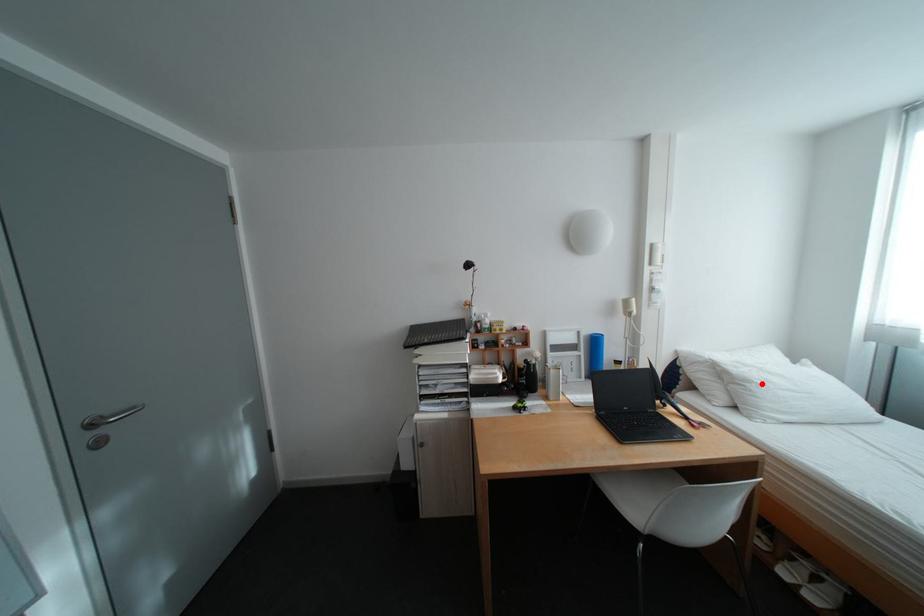
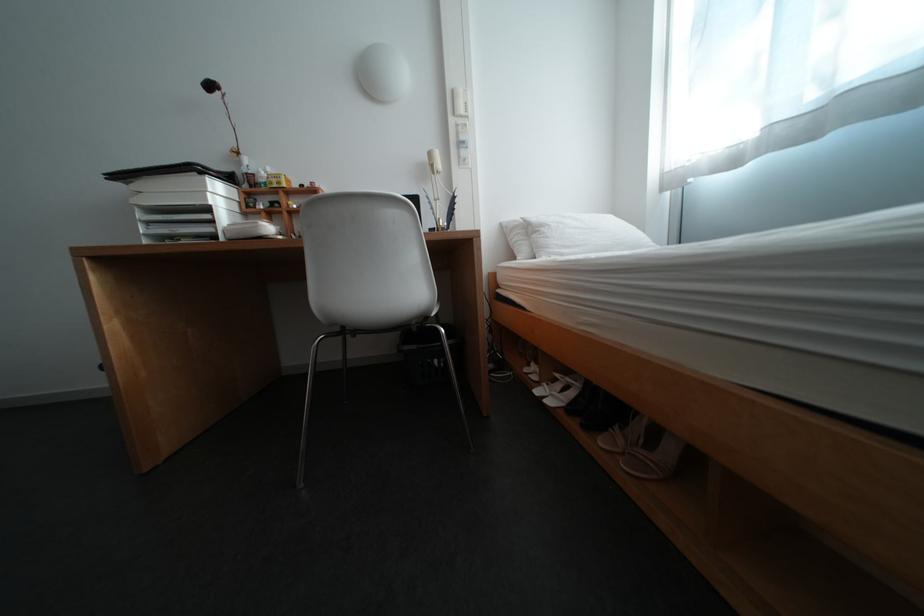
Where in the second image is the point corresponding to the highlighted location from the first image?

(555, 228)